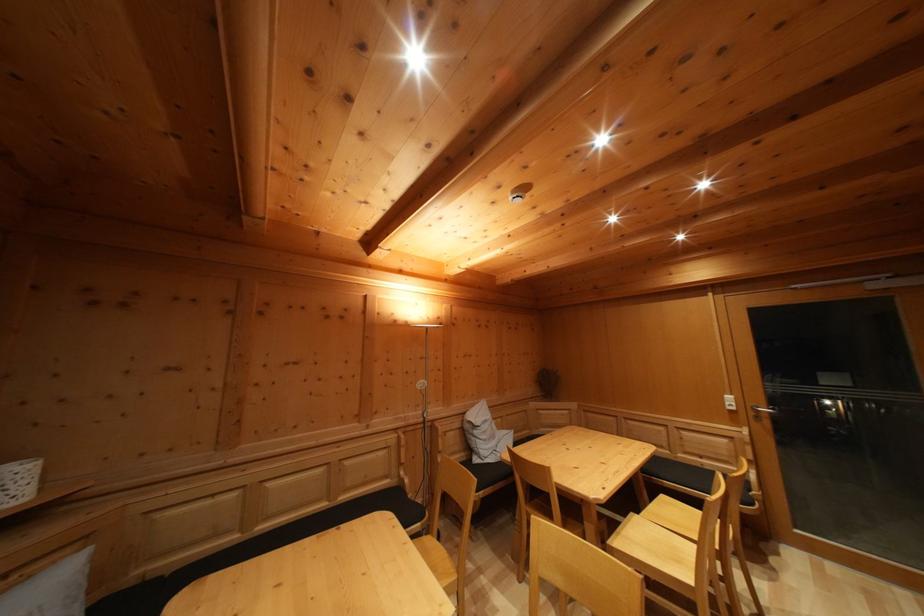
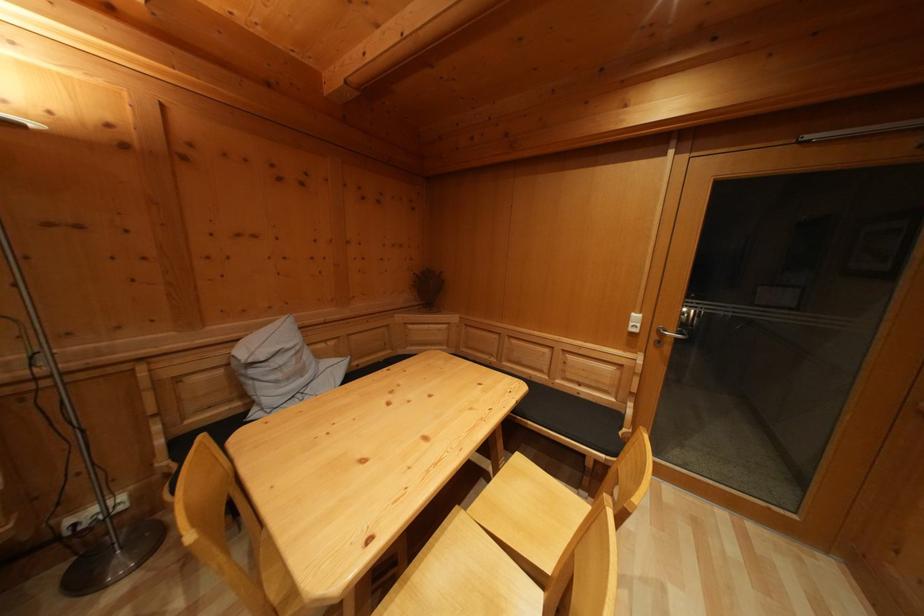
The images are taken continuously from a first-person perspective. In which direction are you moving?

The cameraman walked toward right, forward.